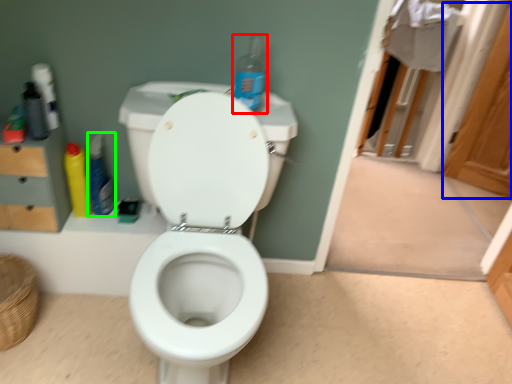
Question: Which object is the closest to the cleaning product (highlighted by a red box)? Choose among these: screen door (highlighted by a blue box) or cleaning product (highlighted by a green box).

Choices:
 (A) screen door
 (B) cleaning product

Answer: (B)